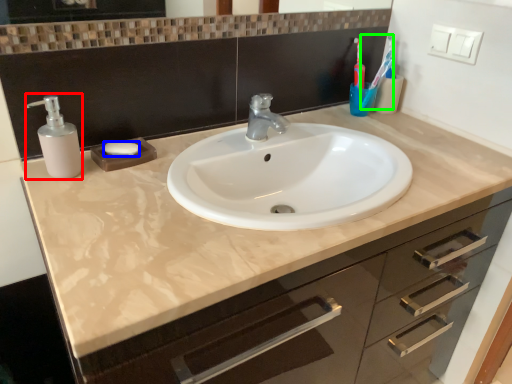
Question: Estimate the real-world distances between objects in this image. Which object is closer to soap dispenser (highlighted by a red box), soap (highlighted by a blue box) or toothbrush (highlighted by a green box)?

Choices:
 (A) soap
 (B) toothbrush

Answer: (A)